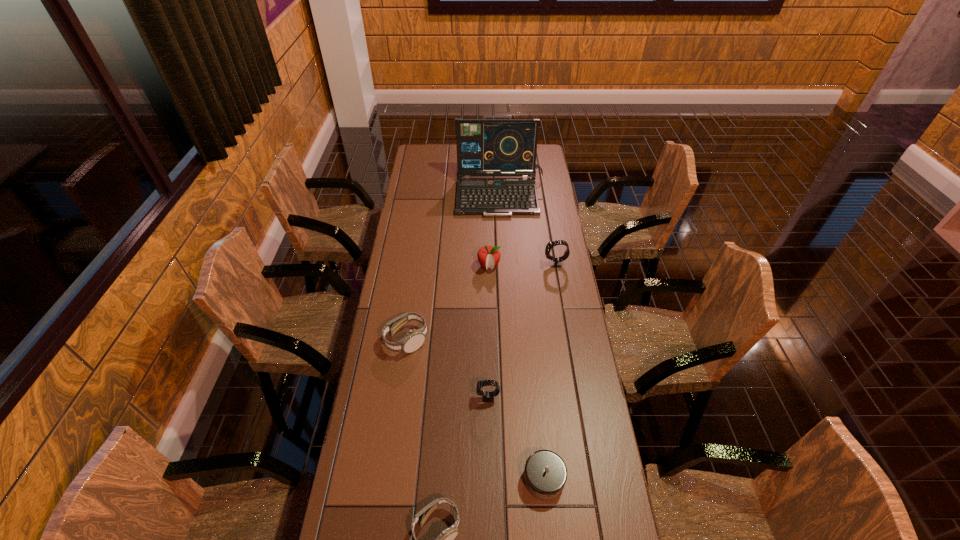
The width and height of the screenshot is (960, 540). Identify the location of the seventh farthest object. (0, 0).

At what (x,y) coordinates should I click in order to perform the action: click on the nearest gray watch. Please return your answer as a coordinate pair (x, y). Image resolution: width=960 pixels, height=540 pixels. Looking at the image, I should click on (0, 0).

Image resolution: width=960 pixels, height=540 pixels. Find the location of `the third nearest object`. the third nearest object is located at coordinates (0, 0).

Locate an element on the screen. This screenshot has height=540, width=960. free space located on the front-facing side of the seventh nearest object is located at coordinates (503, 245).

At what (x,y) coordinates should I click in order to perform the action: click on free region located 0.150m on the face of the farthest object. Please return your answer as a coordinate pair (x, y). Looking at the image, I should click on (455, 149).

At what (x,y) coordinates should I click in order to perform the action: click on vacant space located on the face of the farthest object. Please return your answer as a coordinate pair (x, y). This screenshot has height=540, width=960. Looking at the image, I should click on (435, 149).

Identify the location of vacant space located on the face of the farthest object. This screenshot has height=540, width=960. (430, 149).

This screenshot has width=960, height=540. Find the location of `vacant space situated 0.110m on the face of the second farthest gray watch`. vacant space situated 0.110m on the face of the second farthest gray watch is located at coordinates (517, 264).

This screenshot has height=540, width=960. I want to click on free space located on the face of the second farthest gray watch, so click(505, 264).

Locate an element on the screen. The image size is (960, 540). vacant space positioned on the face of the second farthest gray watch is located at coordinates (527, 264).